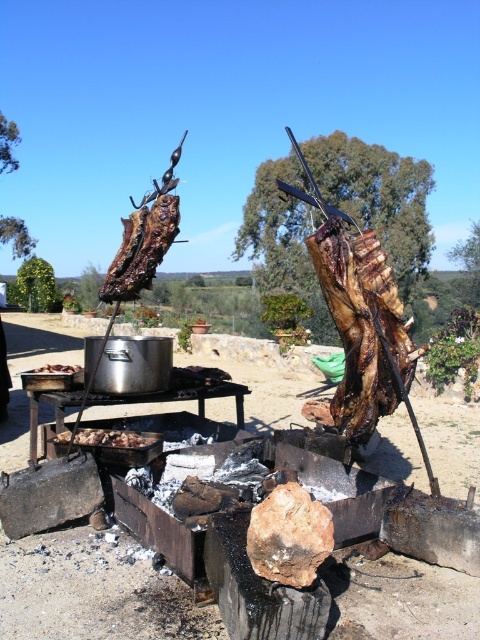
Can you confirm if charred wood plank at center is thinner than brown charred meat at left?

Incorrect, charred wood plank at center's width is not less than brown charred meat at left's.

Does point (162, 236) lie behind point (51, 365)?

No, it is not.

This screenshot has height=640, width=480. I want to click on charred wood plank at center, so click(141, 250).

This screenshot has width=480, height=640. What do you see at coordinates (141, 250) in the screenshot?
I see `charred wood plank at center` at bounding box center [141, 250].

Identify the location of charred wood plank at center. (141, 250).

The image size is (480, 640). I want to click on charred wood plank at center, so click(x=141, y=250).

From the picture: Who is more forward, (79, 442) or (34, 372)?

Positioned in front is point (79, 442).

Find the location of `brown charred meat at lower left`. brown charred meat at lower left is located at coordinates (106, 438).